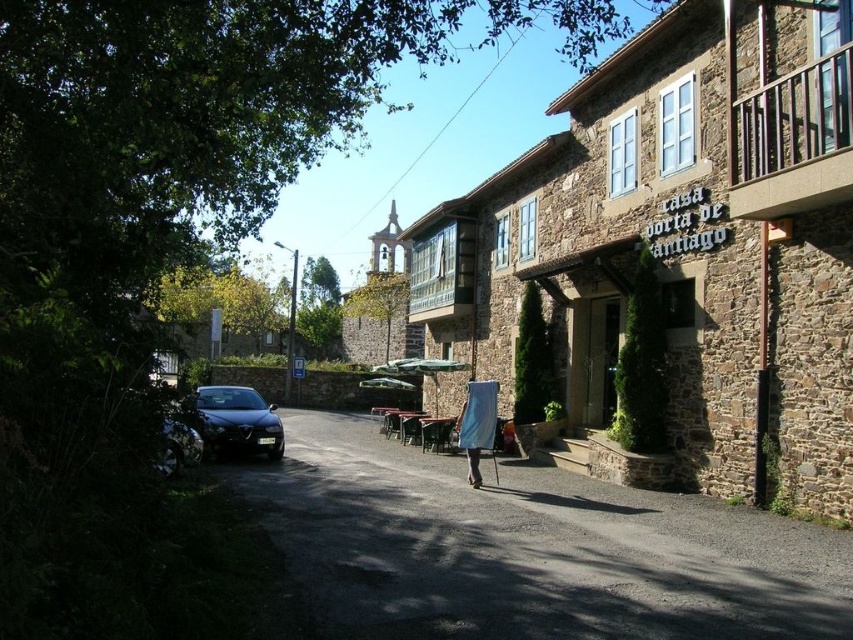
Question: Is dark asphalt road at center behind blue fabric at center?

Choices:
 (A) yes
 (B) no

Answer: (B)

Question: Which point is farther to the camera?

Choices:
 (A) blue fabric at center
 (B) shiny black car at center

Answer: (A)

Question: Considering the real-world distances, which object is closest to the shiny black car at center?

Choices:
 (A) blue fabric at center
 (B) dark asphalt road at center
 (C) stone building at center

Answer: (B)

Question: Does dark asphalt road at center have a greater width compared to shiny black car at center?

Choices:
 (A) yes
 (B) no

Answer: (A)

Question: Is stone building at center behind blue fabric at center?

Choices:
 (A) yes
 (B) no

Answer: (B)

Question: Which point is farther to the camera?

Choices:
 (A) dark asphalt road at center
 (B) shiny black car at center
 (C) blue fabric at center

Answer: (C)